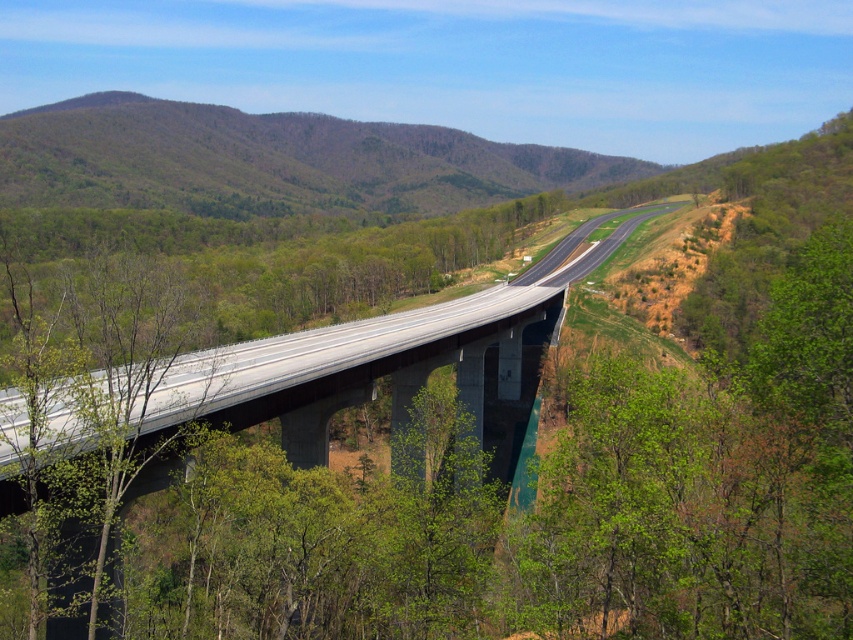
Does green leafy forest at upper center come behind green leafy tree at center?

Yes, green leafy forest at upper center is behind green leafy tree at center.

The height and width of the screenshot is (640, 853). What do you see at coordinates (270, 161) in the screenshot? I see `green leafy forest at upper center` at bounding box center [270, 161].

I want to click on green leafy forest at upper center, so click(270, 161).